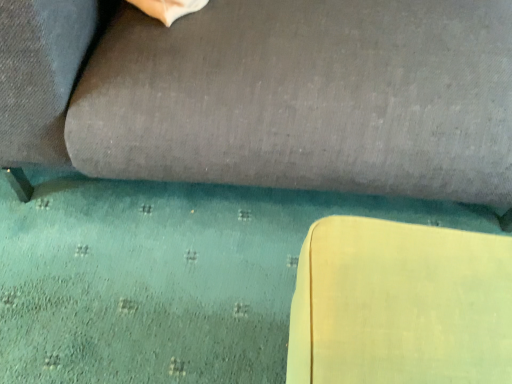
Image resolution: width=512 pixels, height=384 pixels. Describe the element at coordinates (400, 305) in the screenshot. I see `yellow fabric cushion at lower right` at that location.

What is the approximate width of yellow fabric cushion at lower right?

It is 25.07 centimeters.

The image size is (512, 384). I want to click on yellow fabric cushion at lower right, so click(400, 305).

Where is `yellow fabric cushion at lower right`? yellow fabric cushion at lower right is located at coordinates (400, 305).